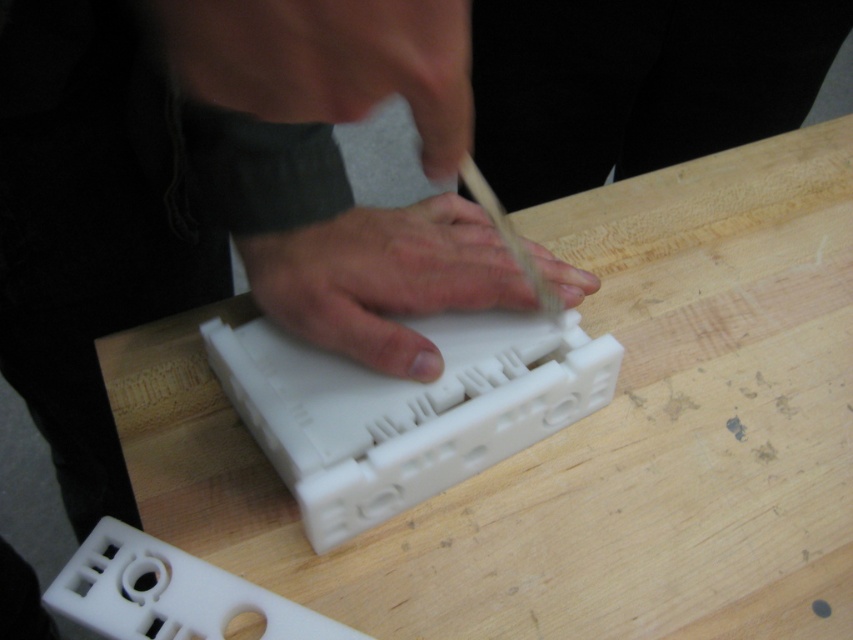
Question: Does white matte plastic object at center have a lesser width compared to matte black hand at upper center?

Choices:
 (A) yes
 (B) no

Answer: (B)

Question: Which point is closer to the camera?

Choices:
 (A) wooden stick at center
 (B) white matte wood at center
 (C) matte black hand at upper center
 (D) white matte plastic object at center

Answer: (C)

Question: Is matte black hand at upper center wider than white matte hand at center?

Choices:
 (A) no
 (B) yes

Answer: (A)

Question: Which of the following is the closest to the observer?

Choices:
 (A) (339, 92)
 (B) (554, 264)
 (C) (573, 221)
 (D) (473, 189)

Answer: (A)

Question: Among these objects, which one is farthest from the camera?

Choices:
 (A) white matte wood at center
 (B) wooden stick at center
 (C) matte black hand at upper center
 (D) white matte plastic object at center

Answer: (A)

Question: Is white matte wood at center thinner than matte black hand at upper center?

Choices:
 (A) yes
 (B) no

Answer: (B)